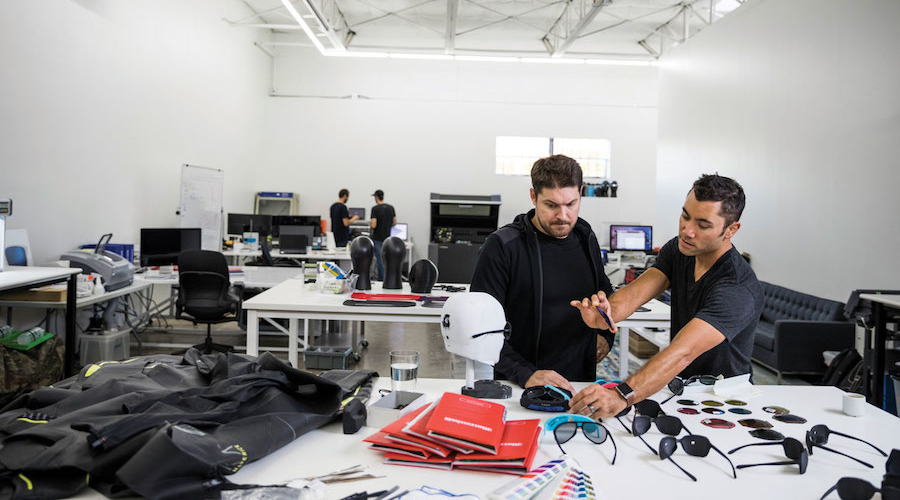
At what (x,y) coordinates should I click in order to perform the action: click on computer monitor. Please return your answer as a coordinate pair (x, y). The width and height of the screenshot is (900, 500). Looking at the image, I should click on (155, 236), (290, 222), (257, 221).